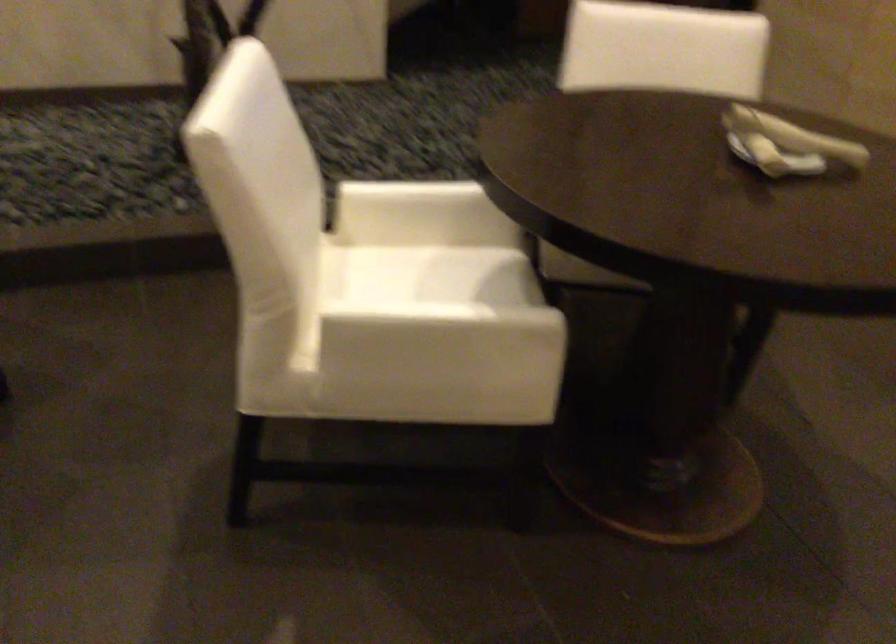
Image resolution: width=896 pixels, height=644 pixels. I want to click on white chair armrest, so click(x=418, y=214).